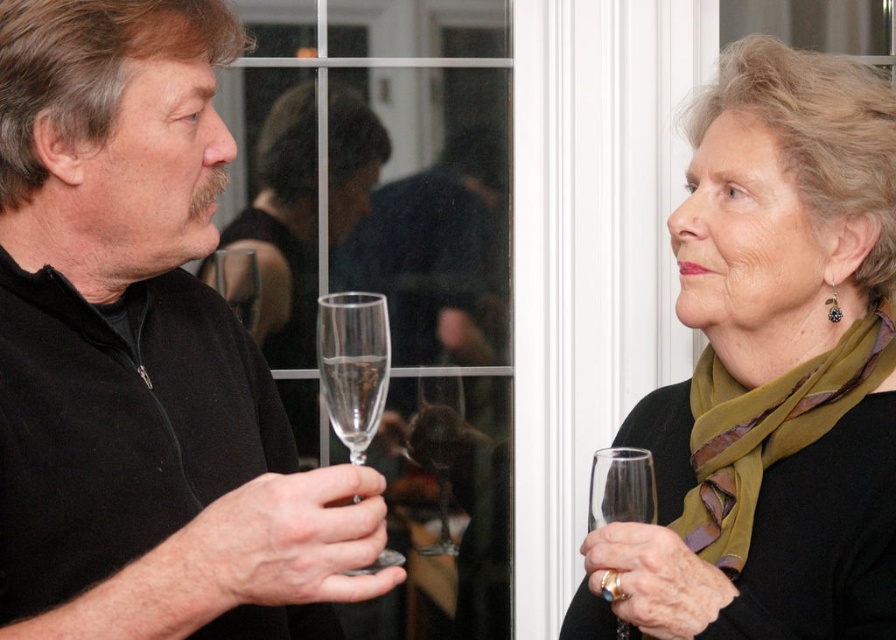
You are a photographer at a social event and need to capture a closeup shot of the clear glass wine glass at left without including the matte green scarf at right in the frame. Based on their positions, is this possible?

The matte green scarf at right is positioned on the right side of the clear glass wine glass at left. Therefore, moving the camera to the left side of the clear glass wine glass at left would allow you to frame the shot so that the matte green scarf at right is out of the frame to the right, capturing only the clear glass wine glass at left.

In the scene shown: You are a bartender observing two guests at a party. You notice a clear glass flute at left and a clear glass flute at center. Which one is positioned lower in the image?

The clear glass flute at left is positioned lower than the clear glass flute at center, so the one at left is lower.

From the picture: You are at a party and need to pour sparkling water into both the clear glass flute at left and the clear glass flute at center. Which flute should you choose to avoid spilling if you only have a limited amount of water?

The clear glass flute at center has a smaller size, so you should choose it to avoid spilling when pouring a limited amount of sparkling water.